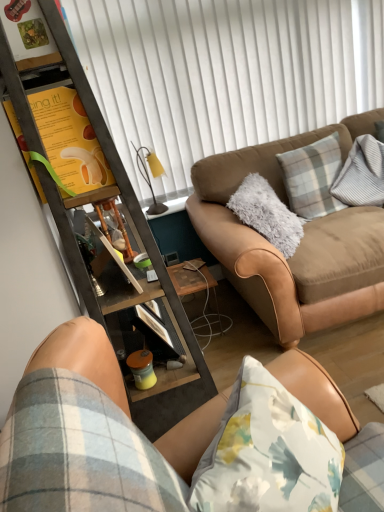
What do you see at coordinates (224, 73) in the screenshot? I see `white matte shutter at upper center` at bounding box center [224, 73].

Identify the location of metallic brown cabinet at left. (95, 196).

Locate an element on the screen. This screenshot has width=384, height=512. matte yellow cup at lower center is located at coordinates (142, 369).

The height and width of the screenshot is (512, 384). What are the coordinates of `white matte shutter at upper center` in the screenshot? It's located at (224, 73).

Can you tell me how much matte yellow cup at lower center and white matte shutter at upper center differ in facing direction?

There is a 89-degree angle between the facing directions of matte yellow cup at lower center and white matte shutter at upper center.

Is matte yellow cup at lower center not near white matte shutter at upper center?

Yes, matte yellow cup at lower center is far from white matte shutter at upper center.

Would you say white matte shutter at upper center is part of matte yellow cup at lower center's contents?

No, white matte shutter at upper center is not surrounded by matte yellow cup at lower center.

Is matte yellow cup at lower center shorter than white matte shutter at upper center?

Indeed, matte yellow cup at lower center has a lesser height compared to white matte shutter at upper center.

Considering the relative sizes of yellow matte lamp at upper center and plaid fabric pillow at upper right in the image provided, is yellow matte lamp at upper center wider than plaid fabric pillow at upper right?

No, yellow matte lamp at upper center is not wider than plaid fabric pillow at upper right.

Is point (152, 196) positioned before point (327, 203)?

No.

Can you confirm if yellow matte lamp at upper center is taller than plaid fabric pillow at upper right?

In fact, yellow matte lamp at upper center may be shorter than plaid fabric pillow at upper right.

Is yellow matte lamp at upper center bigger than plaid fabric pillow at upper right?

Actually, yellow matte lamp at upper center might be smaller than plaid fabric pillow at upper right.

In terms of width, does plaid fabric pillow at upper right look wider or thinner when compared to suede tan couch at lower right, the second studio couch viewed from the back?

In the image, plaid fabric pillow at upper right appears to be more narrow than suede tan couch at lower right, the second studio couch viewed from the back.

From the image's perspective, between plaid fabric pillow at upper right and suede tan couch at lower right, which is the first studio couch from front to back, who is located below?

suede tan couch at lower right, which is the first studio couch from front to back, appears lower in the image.

Does plaid fabric pillow at upper right lie in front of suede tan couch at lower right, the second studio couch viewed from the back?

That is False.

Is suede tan couch at lower right, the second studio couch viewed from the back, a part of plaid fabric pillow at upper right?

That's incorrect, suede tan couch at lower right, the second studio couch viewed from the back, is not inside plaid fabric pillow at upper right.

Is matte yellow cup at lower center bigger than suede brown couch at center, which is the second studio couch from front to back?

No.

Are matte yellow cup at lower center and suede brown couch at center, which is the second studio couch from front to back, beside each other?

No, matte yellow cup at lower center is not touching suede brown couch at center, which is the second studio couch from front to back.

Is matte yellow cup at lower center aimed at suede brown couch at center, which is the second studio couch from front to back?

No, matte yellow cup at lower center is not turned towards suede brown couch at center, which is the second studio couch from front to back.

Measure the distance from matte yellow cup at lower center to suede brown couch at center, which is the second studio couch from front to back.

matte yellow cup at lower center and suede brown couch at center, which is the second studio couch from front to back, are 38.96 inches apart.

From a real-world perspective, who is located higher, suede tan couch at lower right, the second studio couch viewed from the back, or yellow paper at upper left?

From a 3D spatial view, yellow paper at upper left is above.

Can you confirm if suede tan couch at lower right, which is the first studio couch from front to back, is smaller than yellow paper at upper left?

No, suede tan couch at lower right, which is the first studio couch from front to back, is not smaller than yellow paper at upper left.

Based on the photo, is suede tan couch at lower right, the second studio couch viewed from the back, far from yellow paper at upper left?

No.

Considering the sizes of objects suede tan couch at lower right, which is the first studio couch from front to back, and white matte shutter at upper center in the image provided, who is taller, suede tan couch at lower right, which is the first studio couch from front to back, or white matte shutter at upper center?

white matte shutter at upper center is taller.

Which object is positioned more to the left, suede tan couch at lower right, the second studio couch viewed from the back, or white matte shutter at upper center?

suede tan couch at lower right, the second studio couch viewed from the back, is more to the left.

How much distance is there between suede tan couch at lower right, the second studio couch viewed from the back, and white matte shutter at upper center?

suede tan couch at lower right, the second studio couch viewed from the back, is 6.91 feet away from white matte shutter at upper center.

In the scene shown: Does suede tan couch at lower right, the second studio couch viewed from the back, have a greater width compared to white matte shutter at upper center?

Correct, the width of suede tan couch at lower right, the second studio couch viewed from the back, exceeds that of white matte shutter at upper center.

In terms of size, does suede tan couch at lower right, the second studio couch viewed from the back, appear bigger or smaller than plaid fabric pillow at upper right?

Clearly, suede tan couch at lower right, the second studio couch viewed from the back, is larger in size than plaid fabric pillow at upper right.

Considering the sizes of objects suede tan couch at lower right, which is the first studio couch from front to back, and plaid fabric pillow at upper right in the image provided, who is taller, suede tan couch at lower right, which is the first studio couch from front to back, or plaid fabric pillow at upper right?

plaid fabric pillow at upper right.

Is point (166, 498) closer or farther from the camera than point (318, 196)?

Point (166, 498) appears to be closer to the viewer than point (318, 196).

Looking at this image, which object is positioned more to the left, suede tan couch at lower right, which is the first studio couch from front to back, or plaid fabric pillow at upper right?

suede tan couch at lower right, which is the first studio couch from front to back.

Identify the location of shutter that is on the right side of matte yellow cup at lower center. The image size is (384, 512). (224, 73).

You are a GUI agent. You are given a task and a screenshot of the screen. Output one action in this format:
    pyautogui.click(x=<x>, y=<y>)
    Task: Click on the lamp lying above the plaid fabric pillow at upper right (from the image's perspective)
    The image size is (384, 512).
    Given the screenshot: What is the action you would take?
    pyautogui.click(x=149, y=177)

Considering their positions, is white matte shutter at upper center positioned further to wooden side table at lower center than yellow matte lamp at upper center?

The object further to wooden side table at lower center is white matte shutter at upper center.

Considering their positions, is wooden side table at lower center positioned further to yellow matte lamp at upper center than yellow paper at upper left?

yellow paper at upper left.

Estimate the real-world distances between objects in this image. Which object is closer to yellow matte lamp at upper center, wooden side table at lower center or suede tan couch at lower right, which is the first studio couch from front to back?

wooden side table at lower center.

Considering their positions, is white matte shutter at upper center positioned further to yellow paper at upper left than yellow matte lamp at upper center?

Among the two, white matte shutter at upper center is located further to yellow paper at upper left.

When comparing their distances from suede brown couch at center, which is the second studio couch from front to back, does plaid fabric pillow at upper right or wooden side table at lower center seem closer?

plaid fabric pillow at upper right is closer to suede brown couch at center, which is the second studio couch from front to back.

When comparing their distances from suede tan couch at lower right, which is the first studio couch from front to back, does metallic brown cabinet at left or white matte shutter at upper center seem closer?

Based on the image, metallic brown cabinet at left appears to be nearer to suede tan couch at lower right, which is the first studio couch from front to back.

Based on their spatial positions, is yellow paper at upper left or white matte shutter at upper center closer to suede brown couch at center, which is the second studio couch from front to back?

Based on the image, white matte shutter at upper center appears to be nearer to suede brown couch at center, which is the second studio couch from front to back.

Consider the image. Considering their positions, is matte yellow cup at lower center positioned closer to suede brown couch at center, marked as the first studio couch in a back-to-front arrangement, than suede tan couch at lower right, the second studio couch viewed from the back?

matte yellow cup at lower center.

You are a GUI agent. You are given a task and a screenshot of the screen. Output one action in this format:
    pyautogui.click(x=<x>, y=<y>)
    Task: Click on the bulletin board positioned between suede tan couch at lower right, which is the first studio couch from front to back, and yellow matte lamp at upper center from near to far
    The image size is (384, 512).
    Given the screenshot: What is the action you would take?
    (70, 141)

I want to click on cabinetry between white matte shutter at upper center and matte yellow cup at lower center vertically, so click(x=95, y=196).

The width and height of the screenshot is (384, 512). In order to click on pillow located between wooden side table at lower center and suede brown couch at center, marked as the first studio couch in a back-to-front arrangement, in the left-right direction in this screenshot , I will do [312, 177].

Locate an element on the screen. The width and height of the screenshot is (384, 512). pillow between yellow paper at upper left and suede brown couch at center, which is the second studio couch from front to back, in the horizontal direction is located at coordinates (312, 177).